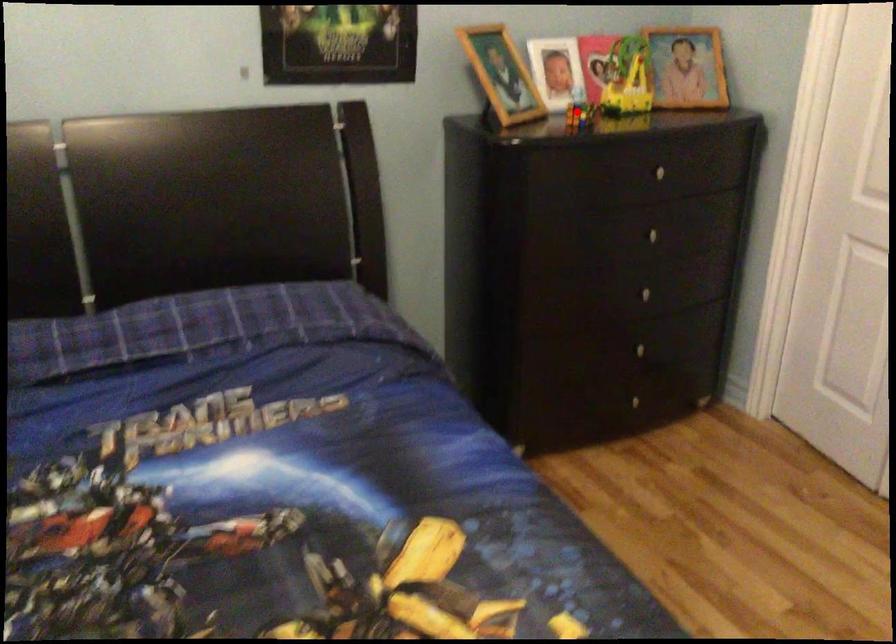
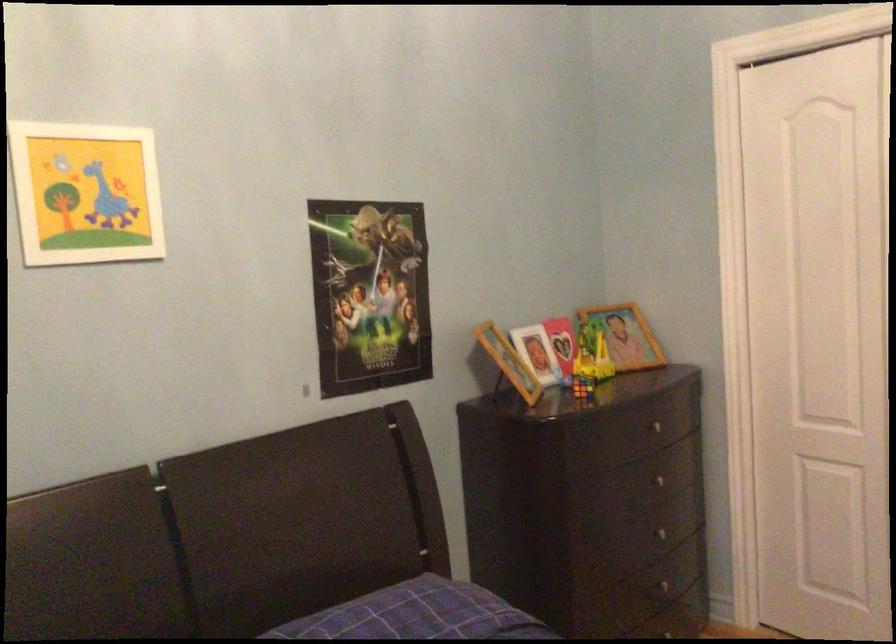
Find the pixel in the second image that matches the highlighted location in the first image.

(582, 386)